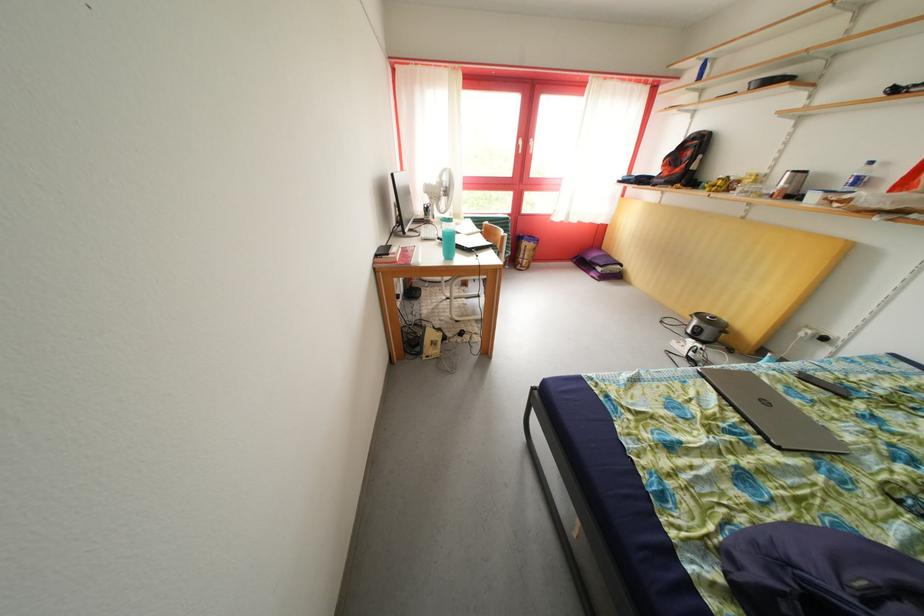
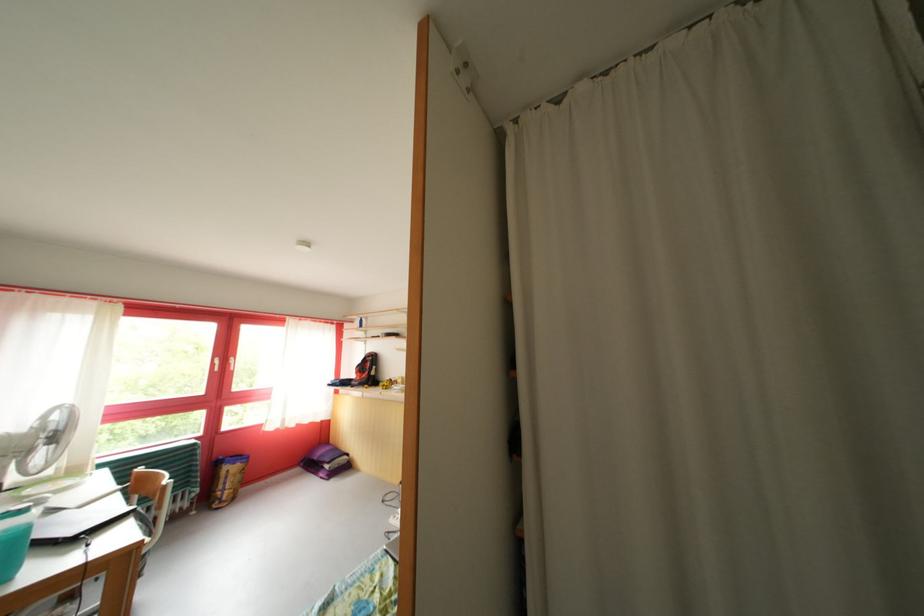
The images are taken continuously from a first-person perspective. In which direction is your viewpoint rotating?

The camera's rotation is toward right-up.